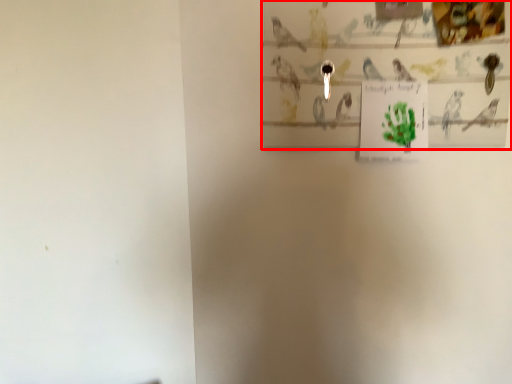
Question: From the image, what is the correct spatial relationship of picture frame (annotated by the red box) in relation to postcard?

Choices:
 (A) right
 (B) left

Answer: (B)